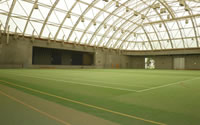
Identify the location of stage area. The image size is (200, 125). (66, 59).